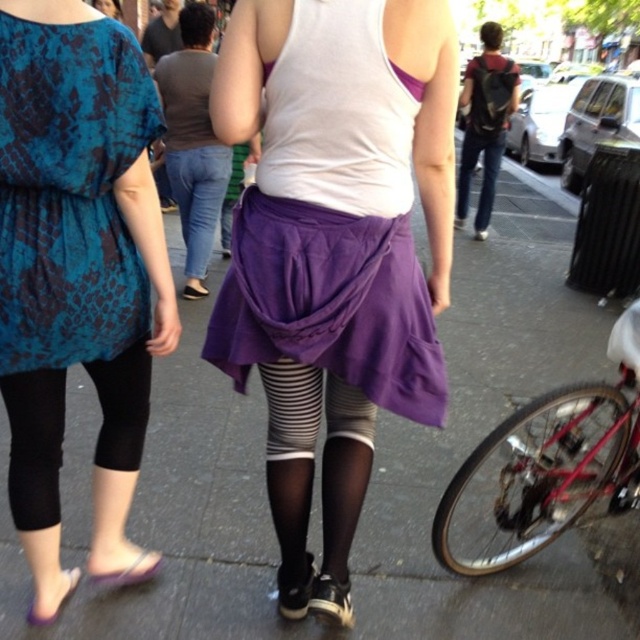
Question: Which point is farther to the camera?

Choices:
 (A) teal snakeskin dress at upper left
 (B) shiny red bicycle at lower right
 (C) purple quilted skirt at center
 (D) purple fabric skirt at center

Answer: (D)

Question: Is teal snakeskin dress at upper left to the left of shiny red bicycle at lower right from the viewer's perspective?

Choices:
 (A) no
 (B) yes

Answer: (B)

Question: Among these objects, which one is nearest to the camera?

Choices:
 (A) teal snakeskin dress at upper left
 (B) shiny red bicycle at lower right
 (C) purple quilted skirt at center

Answer: (A)

Question: Does purple quilted skirt at center appear under purple fabric skirt at center?

Choices:
 (A) no
 (B) yes

Answer: (B)

Question: Which of the following is the farthest from the observer?

Choices:
 (A) (49, 84)
 (B) (202, 272)

Answer: (B)

Question: Is purple quilted skirt at center behind shiny red bicycle at lower right?

Choices:
 (A) yes
 (B) no

Answer: (B)